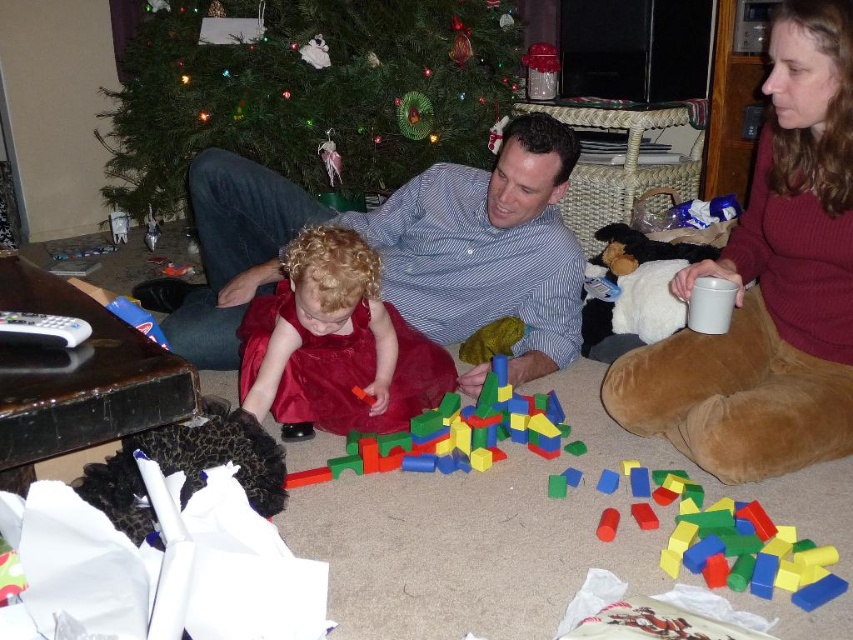
Is blue striped shirt at center wider than velvet red dress at center?

Yes.

Between blue striped shirt at center and velvet red dress at center, which one appears on the left side from the viewer's perspective?

blue striped shirt at center

Find the location of `blue striped shirt at center`. blue striped shirt at center is located at coordinates (401, 248).

In order to click on blue striped shirt at center in this screenshot , I will do `click(401, 248)`.

Which is more to the left, smooth wooden blocks at center or matte red sweater at right?

From the viewer's perspective, smooth wooden blocks at center appears more on the left side.

Is point (776, 129) in front of point (722, 444)?

No, (776, 129) is behind (722, 444).

Locate an element on the screen. This screenshot has height=640, width=853. smooth wooden blocks at center is located at coordinates (770, 284).

Does blue striped shirt at center have a lesser width compared to wooden blocks at center?

No, blue striped shirt at center is not thinner than wooden blocks at center.

Which is more to the left, blue striped shirt at center or wooden blocks at center?

blue striped shirt at center is more to the left.

This screenshot has height=640, width=853. Identify the location of blue striped shirt at center. (401, 248).